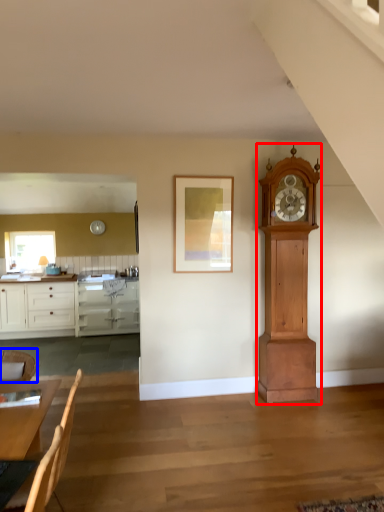
Question: Which point is further to the camera, wall clock (highlighted by a red box) or chair (highlighted by a blue box)?

Choices:
 (A) wall clock
 (B) chair

Answer: (A)